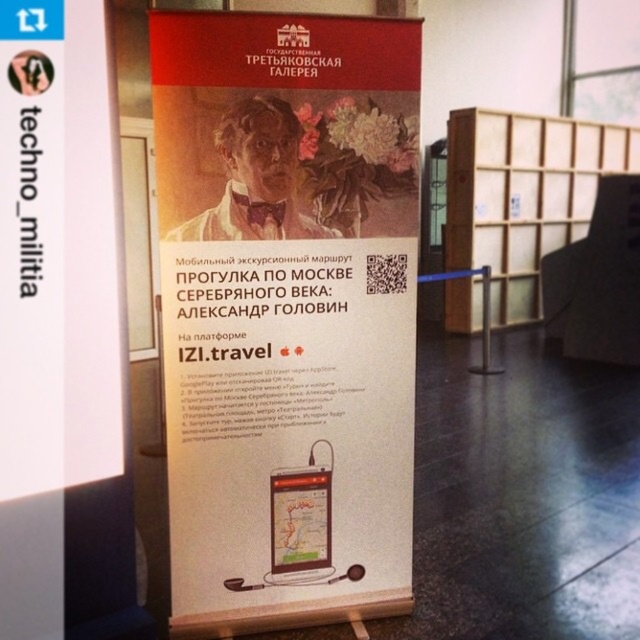
Who is lower down, white paper poster at center or wooden at right?

white paper poster at center is below.

Can you confirm if white paper poster at center is bigger than wooden at right?

No.

This screenshot has width=640, height=640. In order to click on white paper poster at center in this screenshot , I will do `click(285, 314)`.